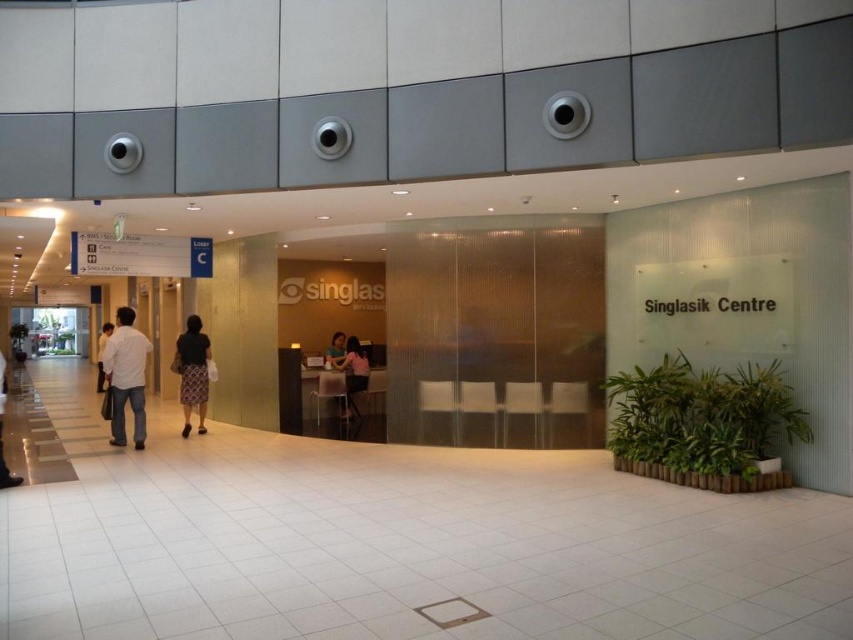
You are standing at the entrance of Singlasik Centre and notice a person wearing a pink fabric shirt at center. If you want to approach them, which direction should you walk from your current position?

Since the pink fabric shirt at center is located at point 0.583 on the x axis and 0.414 on the y axis, you should walk towards the center of the entrance area to reach them.

You are a visitor at the Singlasik Centre and see a person wearing a pink fabric shirt at center and white casual pants at left. Which clothing item is covering the other?

The pink fabric shirt at center is positioned over the white casual pants at left, so the shirt is covering the pants.